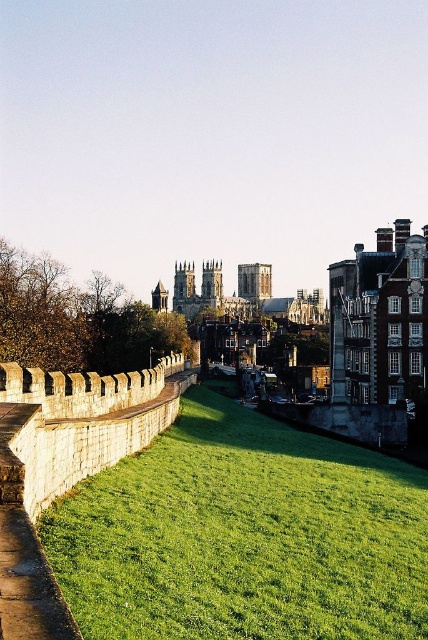
Question: Which of these objects is positioned farthest from the smooth stone tower at center?

Choices:
 (A) dark brown stone tower at center
 (B) green grassy at center

Answer: (B)

Question: Does green grassy at center appear over smooth stone tower at center?

Choices:
 (A) no
 (B) yes

Answer: (A)

Question: Is green grassy at center smaller than dark brown stone tower at center?

Choices:
 (A) yes
 (B) no

Answer: (A)

Question: Based on their relative distances, which object is nearer to the green grassy at center?

Choices:
 (A) dark brown stone tower at center
 (B) smooth stone tower at center

Answer: (B)

Question: Among these objects, which one is farthest from the camera?

Choices:
 (A) smooth stone tower at center
 (B) dark brown stone tower at center
 (C) green grassy at center

Answer: (B)

Question: Does green grassy at center appear over dark brown stone tower at center?

Choices:
 (A) no
 (B) yes

Answer: (A)